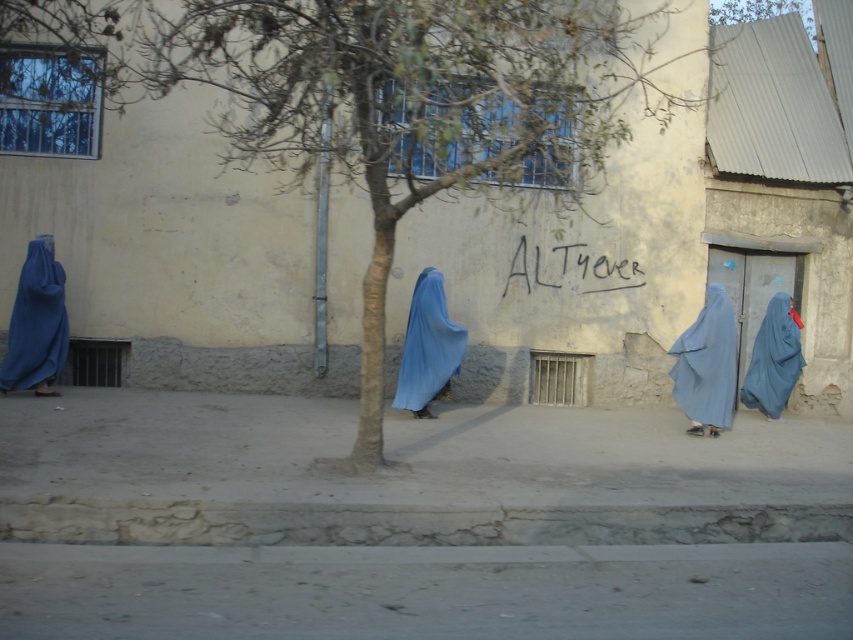
Question: Does light blue fabric at center come behind blue matte burqa at center?

Choices:
 (A) yes
 (B) no

Answer: (B)

Question: Estimate the real-world distances between objects in this image. Which object is farther from the green leafy tree at center?

Choices:
 (A) blue fabric burqa at left
 (B) blue matte burqa at center
 (C) blue matte burqa at right

Answer: (C)

Question: Which of the following is the farthest from the observer?

Choices:
 (A) (753, 384)
 (B) (721, 292)
 (C) (428, 324)
 (D) (45, 248)

Answer: (A)

Question: Is blue fabric burqa at left above light blue fabric at center?

Choices:
 (A) no
 (B) yes

Answer: (B)

Question: Is green leafy tree at center closer to the viewer compared to blue fabric burqa at left?

Choices:
 (A) yes
 (B) no

Answer: (A)

Question: Which of the following is the farthest from the observer?

Choices:
 (A) blue matte burqa at right
 (B) blue matte burqa at center

Answer: (A)